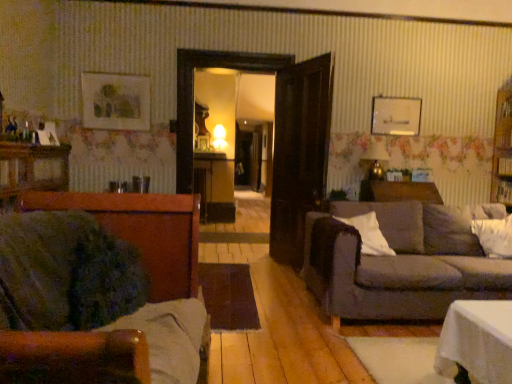
How much space does dark gray fabric couch at right, which is the 1th studio couch in right-to-left order, occupy vertically?

31.66 inches.

Where is `dark gray fabric couch at right, which is the 1th studio couch in right-to-left order`? dark gray fabric couch at right, which is the 1th studio couch in right-to-left order is located at coordinates (399, 263).

Describe the element at coordinates (369, 234) in the screenshot. This screenshot has width=512, height=384. I see `white soft pillow at right, the second pillow in the right-to-left sequence` at that location.

The width and height of the screenshot is (512, 384). In order to click on white soft pillow at right, the second pillow in the right-to-left sequence in this screenshot , I will do `click(369, 234)`.

What is the approximate width of velvet green couch at left, the 2th studio couch from the back?

velvet green couch at left, the 2th studio couch from the back, is 37.92 inches in width.

In order to click on brown wooden dresser at left in this screenshot , I will do `click(33, 168)`.

I want to click on dark gray fabric couch at right, which is the 1th studio couch in right-to-left order, so click(x=399, y=263).

Is velvet green couch at left, which is the second studio couch from right to left, wider than dark gray fabric couch at right, the 2th studio couch in the front-to-back sequence?

In fact, velvet green couch at left, which is the second studio couch from right to left, might be narrower than dark gray fabric couch at right, the 2th studio couch in the front-to-back sequence.

Would you say velvet green couch at left, which is the first studio couch in front-to-back order, contains dark gray fabric couch at right, the 2th studio couch in the front-to-back sequence?

That's incorrect, dark gray fabric couch at right, the 2th studio couch in the front-to-back sequence, is not inside velvet green couch at left, which is the first studio couch in front-to-back order.

Is point (55, 268) closer or farther from the camera than point (383, 216)?

Point (55, 268) is closer to the camera than point (383, 216).

Could you tell me if velvet green couch at left, which is the first studio couch in front-to-back order, is facing dark gray fabric couch at right, the 2th studio couch in the front-to-back sequence?

No.

Considering the sizes of objects dark gray fabric couch at right, which is the 1th studio couch in right-to-left order, and white soft pillow at right, marked as the 1th pillow in a left-to-right arrangement, in the image provided, who is smaller, dark gray fabric couch at right, which is the 1th studio couch in right-to-left order, or white soft pillow at right, marked as the 1th pillow in a left-to-right arrangement,?

white soft pillow at right, marked as the 1th pillow in a left-to-right arrangement.

From the image's perspective, is dark gray fabric couch at right, the 2th studio couch in the front-to-back sequence, under white soft pillow at right, the second pillow in the right-to-left sequence?

Yes, from the image's perspective, dark gray fabric couch at right, the 2th studio couch in the front-to-back sequence, is below white soft pillow at right, the second pillow in the right-to-left sequence.

Considering the points (403, 304) and (355, 220), which point is behind, point (403, 304) or point (355, 220)?

The point (355, 220) is behind.

From a real-world perspective, which is physically above, white soft pillow at right, the second pillow in the right-to-left sequence, or brown wooden dresser at left?

From a 3D spatial view, brown wooden dresser at left is above.

Is white soft pillow at right, marked as the 1th pillow in a left-to-right arrangement, taller or shorter than brown wooden dresser at left?

In the image, white soft pillow at right, marked as the 1th pillow in a left-to-right arrangement, appears to be shorter than brown wooden dresser at left.

Between white soft pillow at right, the second pillow in the right-to-left sequence, and brown wooden dresser at left, which one is positioned in front?

brown wooden dresser at left is in front.

From the image's perspective, is white soft pillow at right, marked as the 1th pillow in a left-to-right arrangement, under brown wooden dresser at left?

Yes, from the image's perspective, white soft pillow at right, marked as the 1th pillow in a left-to-right arrangement, is below brown wooden dresser at left.

Which object is thinner, white soft pillow at right, marked as the 1th pillow in a left-to-right arrangement, or dark gray fabric couch at right, the second studio couch when ordered from left to right?

white soft pillow at right, marked as the 1th pillow in a left-to-right arrangement, is thinner.

Considering the points (367, 233) and (440, 220), which point is behind, point (367, 233) or point (440, 220)?

The point (440, 220) is farther from the camera.

How many degrees apart are the facing directions of white soft pillow at right, the second pillow in the right-to-left sequence, and dark gray fabric couch at right, the 1th studio couch viewed from the back?

The angle between the facing direction of white soft pillow at right, the second pillow in the right-to-left sequence, and the facing direction of dark gray fabric couch at right, the 1th studio couch viewed from the back, is 1.74 degrees.

From the image's perspective, count 2nd pillows upward from the dark gray fabric couch at right, which is the 1th studio couch in right-to-left order, and point to it. Please provide its 2D coordinates.

[(369, 234)]

Where is `dresser in front of the dark gray fabric couch at right, which is the 1th studio couch in right-to-left order`? dresser in front of the dark gray fabric couch at right, which is the 1th studio couch in right-to-left order is located at coordinates (33, 168).

Does brown wooden dresser at left have a lesser height compared to dark gray fabric couch at right, the 2th studio couch in the front-to-back sequence?

Yes, brown wooden dresser at left is shorter than dark gray fabric couch at right, the 2th studio couch in the front-to-back sequence.

Considering the relative positions of brown wooden dresser at left and dark gray fabric couch at right, the 1th studio couch viewed from the back, in the image provided, is brown wooden dresser at left in front of dark gray fabric couch at right, the 1th studio couch viewed from the back,?

Yes, brown wooden dresser at left is closer to the viewer.

Is point (166, 332) closer or farther from the camera than point (510, 215)?

Clearly, point (166, 332) is closer to the camera than point (510, 215).

Locate an element on the screen. Image resolution: width=512 pixels, height=384 pixels. the 2nd studio couch in front of the white soft pillow at right, placed as the second pillow when sorted from left to right, counting from the anchor's position is located at coordinates (92, 289).

Considering the relative sizes of velvet green couch at left, which is the first studio couch in front-to-back order, and white soft pillow at right, which appears as the first pillow when viewed from the right, in the image provided, is velvet green couch at left, which is the first studio couch in front-to-back order, thinner than white soft pillow at right, which appears as the first pillow when viewed from the right,?

In fact, velvet green couch at left, which is the first studio couch in front-to-back order, might be wider than white soft pillow at right, which appears as the first pillow when viewed from the right.

Is velvet green couch at left, which is the 1th studio couch in left-to-right order, inside or outside of white soft pillow at right, which appears as the first pillow when viewed from the right?

velvet green couch at left, which is the 1th studio couch in left-to-right order, lies outside white soft pillow at right, which appears as the first pillow when viewed from the right.

From a real-world perspective, relative to brown wooden dresser at left, is white soft pillow at right, placed as the second pillow when sorted from left to right, vertically above or below?

white soft pillow at right, placed as the second pillow when sorted from left to right, is situated lower than brown wooden dresser at left in the real world.

Is white soft pillow at right, placed as the second pillow when sorted from left to right, beside brown wooden dresser at left?

They are not placed beside each other.

Find the location of a particular element. The height and width of the screenshot is (384, 512). the 2nd pillow below the brown wooden dresser at left (from a real-world perspective) is located at coordinates [x=494, y=236].

Identify the location of studio couch located on the left of dark gray fabric couch at right, the second studio couch when ordered from left to right. (92, 289).

From the image's perspective, starting from the dark gray fabric couch at right, the second studio couch when ordered from left to right, which pillow is the 2nd one above? Please provide its 2D coordinates.

[(369, 234)]

Looking at this image, when comparing their distances from dark gray fabric couch at right, the second studio couch when ordered from left to right, does white soft pillow at right, placed as the second pillow when sorted from left to right, or white soft pillow at right, marked as the 1th pillow in a left-to-right arrangement, seem further?

white soft pillow at right, placed as the second pillow when sorted from left to right, is positioned further to the anchor dark gray fabric couch at right, the second studio couch when ordered from left to right.

Based on the photo, which object lies further to the anchor point velvet green couch at left, the 2th studio couch from the back, white soft pillow at right, the second pillow in the right-to-left sequence, or brown wooden dresser at left?

Among the two, white soft pillow at right, the second pillow in the right-to-left sequence, is located further to velvet green couch at left, the 2th studio couch from the back.

From the image, which object appears to be farther from white soft pillow at right, marked as the 1th pillow in a left-to-right arrangement, brown wooden dresser at left or dark gray fabric couch at right, the second studio couch when ordered from left to right?

The object further to white soft pillow at right, marked as the 1th pillow in a left-to-right arrangement, is brown wooden dresser at left.

When comparing their distances from velvet green couch at left, which is the second studio couch from right to left, does white soft pillow at right, the second pillow in the right-to-left sequence, or white soft pillow at right, which appears as the first pillow when viewed from the right, seem further?

Among the two, white soft pillow at right, which appears as the first pillow when viewed from the right, is located further to velvet green couch at left, which is the second studio couch from right to left.

Based on their spatial positions, is white soft pillow at right, placed as the second pillow when sorted from left to right, or brown wooden dresser at left closer to white soft pillow at right, marked as the 1th pillow in a left-to-right arrangement?

The object closer to white soft pillow at right, marked as the 1th pillow in a left-to-right arrangement, is white soft pillow at right, placed as the second pillow when sorted from left to right.

Estimate the real-world distances between objects in this image. Which object is further from white soft pillow at right, which appears as the first pillow when viewed from the right, velvet green couch at left, the 2th studio couch from the back, or dark gray fabric couch at right, which is the 1th studio couch in right-to-left order?

Among the two, velvet green couch at left, the 2th studio couch from the back, is located further to white soft pillow at right, which appears as the first pillow when viewed from the right.

When comparing their distances from dark gray fabric couch at right, the second studio couch when ordered from left to right, does velvet green couch at left, which is the first studio couch in front-to-back order, or white soft pillow at right, marked as the 1th pillow in a left-to-right arrangement, seem closer?

white soft pillow at right, marked as the 1th pillow in a left-to-right arrangement, lies closer to dark gray fabric couch at right, the second studio couch when ordered from left to right, than the other object.

Which object lies further to the anchor point white soft pillow at right, the second pillow in the right-to-left sequence, brown wooden dresser at left or velvet green couch at left, which is the first studio couch in front-to-back order?

brown wooden dresser at left.

Where is `pillow positioned between velvet green couch at left, the 2th studio couch from the back, and white soft pillow at right, which appears as the first pillow when viewed from the right, from near to far`? pillow positioned between velvet green couch at left, the 2th studio couch from the back, and white soft pillow at right, which appears as the first pillow when viewed from the right, from near to far is located at coordinates coord(369,234).

The width and height of the screenshot is (512, 384). In order to click on studio couch positioned between velvet green couch at left, which is the second studio couch from right to left, and white soft pillow at right, marked as the 1th pillow in a left-to-right arrangement, from near to far in this screenshot , I will do (x=399, y=263).

The width and height of the screenshot is (512, 384). Find the location of `dresser between velvet green couch at left, which is the 1th studio couch in left-to-right order, and white soft pillow at right, marked as the 1th pillow in a left-to-right arrangement, from front to back`. dresser between velvet green couch at left, which is the 1th studio couch in left-to-right order, and white soft pillow at right, marked as the 1th pillow in a left-to-right arrangement, from front to back is located at coordinates (33, 168).

At what (x,y) coordinates should I click in order to perform the action: click on studio couch located between white soft pillow at right, marked as the 1th pillow in a left-to-right arrangement, and white soft pillow at right, which appears as the first pillow when viewed from the right, in the left-right direction. Please return your answer as a coordinate pair (x, y). Image resolution: width=512 pixels, height=384 pixels. Looking at the image, I should click on (399, 263).